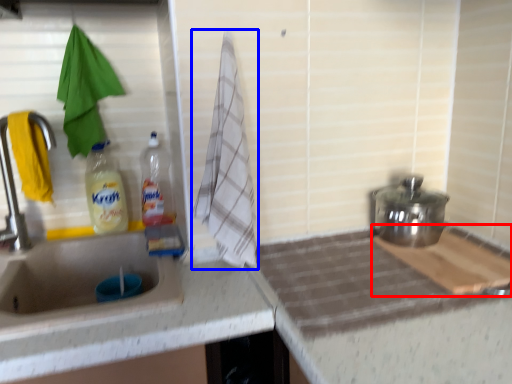
Question: Which object is further to the camera taking this photo, cutting board (highlighted by a red box) or beach towel (highlighted by a blue box)?

Choices:
 (A) cutting board
 (B) beach towel

Answer: (B)